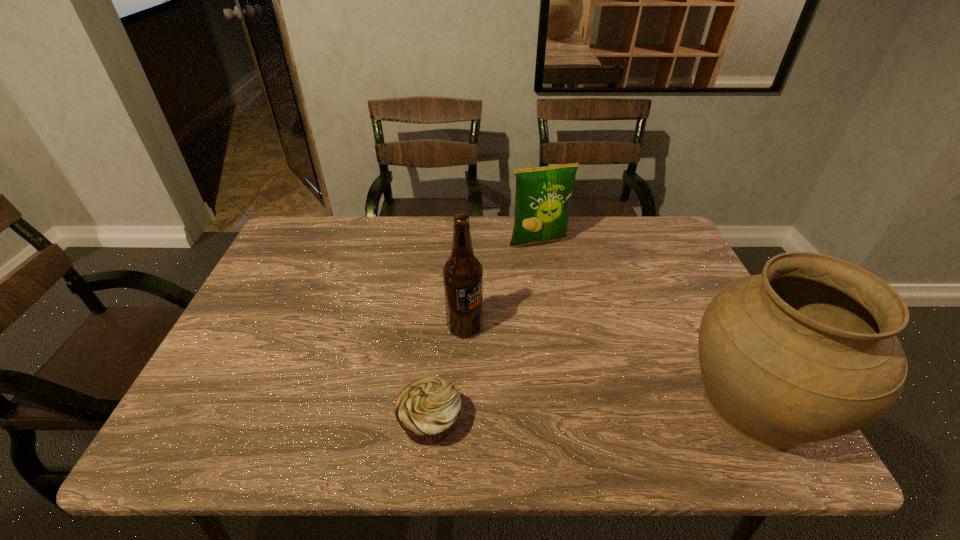
Find the location of a particular element. The image size is (960, 540). free area in between the urn and the muffin is located at coordinates (592, 413).

Where is `free space between the second farthest object and the urn`? The image size is (960, 540). free space between the second farthest object and the urn is located at coordinates (610, 365).

Where is `object that is the second closest to the beer bottle`? This screenshot has height=540, width=960. object that is the second closest to the beer bottle is located at coordinates (543, 194).

You are a GUI agent. You are given a task and a screenshot of the screen. Output one action in this format:
    pyautogui.click(x=<x>, y=<y>)
    Task: Click on the object that is the second closest to the shortest object
    This screenshot has width=960, height=540.
    Given the screenshot: What is the action you would take?
    pyautogui.click(x=807, y=351)

This screenshot has height=540, width=960. In order to click on free space that satisfies the following two spatial constraints: 1. on the back side of the shortest object; 2. on the right side of the beer bottle in this screenshot , I will do `click(439, 327)`.

At what (x,y) coordinates should I click in order to perform the action: click on vacant position in the image that satisfies the following two spatial constraints: 1. on the front side of the rightmost object; 2. on the right side of the third nearest object. Please return your answer as a coordinate pair (x, y). The height and width of the screenshot is (540, 960). Looking at the image, I should click on (462, 403).

This screenshot has width=960, height=540. Identify the location of blank area in the image that satisfies the following two spatial constraints: 1. on the back side of the rightmost object; 2. on the left side of the shortest object. (432, 403).